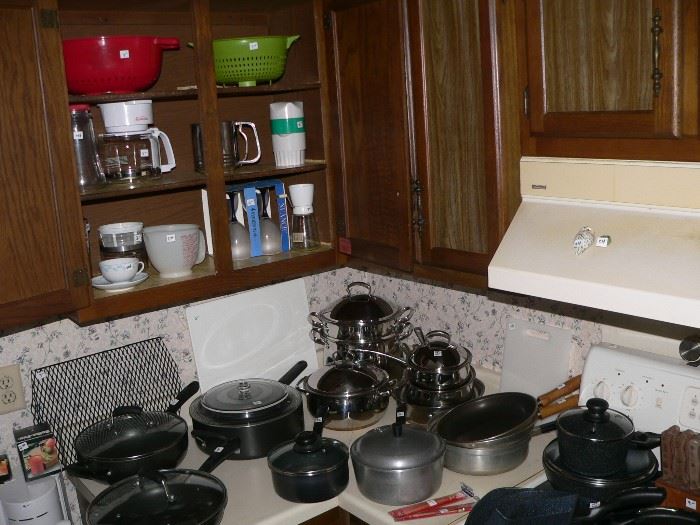
The width and height of the screenshot is (700, 525). Identify the location of outlet. (15, 392).